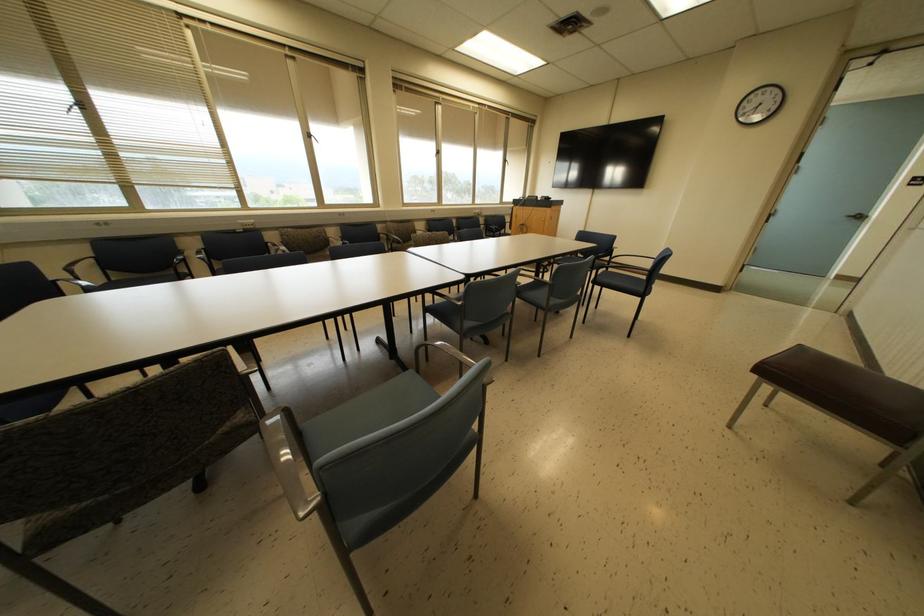
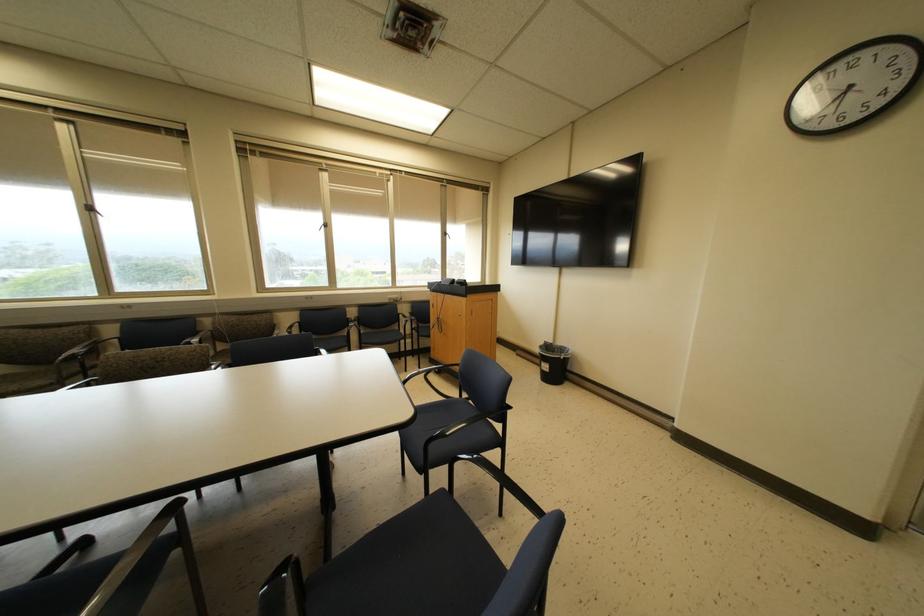
Find the pixel in the second image that matches (504,160) in the first image.

(444, 233)